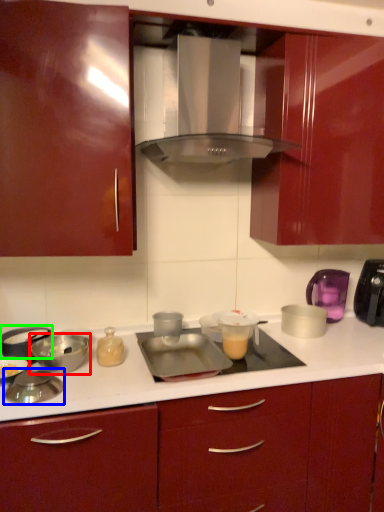
Question: Which object is positioned closest to bowl (highlighted by a red box)? Select from appliance (highlighted by a blue box) and appliance (highlighted by a green box).

Choices:
 (A) appliance
 (B) appliance

Answer: (B)